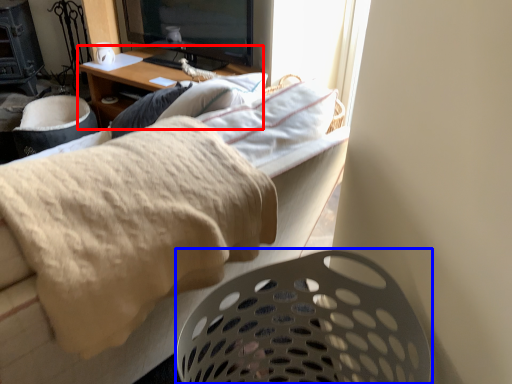
Question: Which of the following is the closest to the observer, desk (highlighted by a red box) or laundry basket (highlighted by a blue box)?

Choices:
 (A) desk
 (B) laundry basket

Answer: (B)